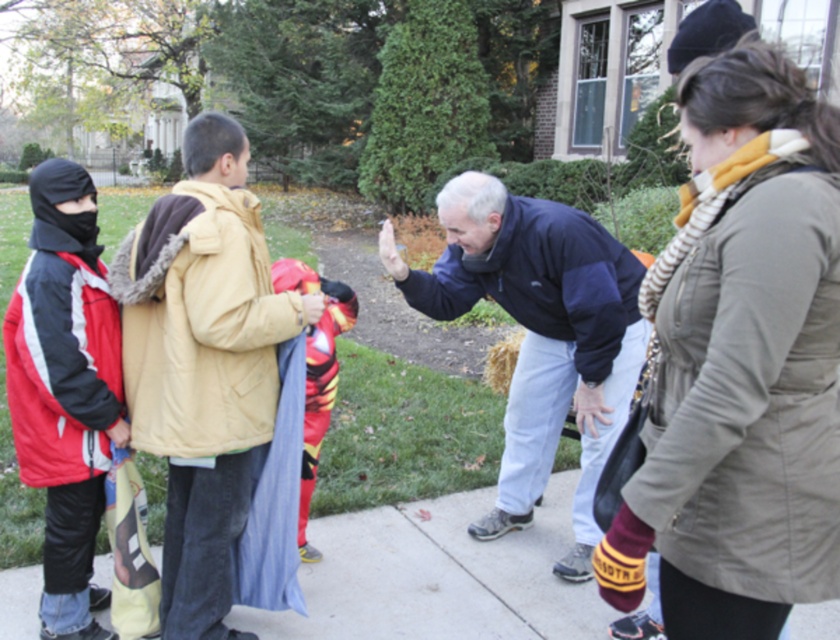
Question: Which point is farther to the camera?

Choices:
 (A) dark blue fleece jacket at center
 (B) red matte jacket at left
 (C) smooth concrete pavement at center
 (D) tan fleece jacket at center

Answer: (A)

Question: Is tan fleece jacket at center wider than smooth concrete pavement at center?

Choices:
 (A) no
 (B) yes

Answer: (A)

Question: Estimate the real-world distances between objects in this image. Which object is closer to the dark blue fleece jacket at center?

Choices:
 (A) smooth concrete pavement at center
 (B) striped scarf at center
 (C) tan fleece jacket at center

Answer: (A)

Question: Is striped scarf at center closer to the viewer compared to tan fleece jacket at center?

Choices:
 (A) yes
 (B) no

Answer: (A)

Question: Can you confirm if striped scarf at center is positioned to the right of dark blue fleece jacket at center?

Choices:
 (A) no
 (B) yes

Answer: (B)

Question: Which point is farther from the camera taking this photo?

Choices:
 (A) (489, 216)
 (B) (331, 572)

Answer: (B)